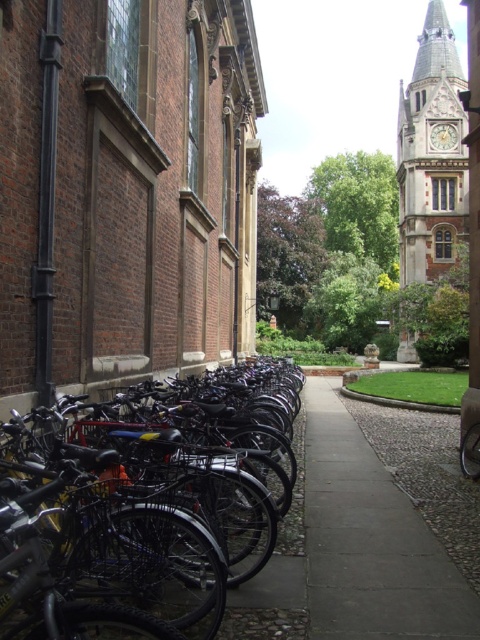
You are standing in front of the brick building and want to take a photo that includes both the point at coordinates point (331, 433) and point (416, 58). Which point will appear larger in your photo?

Point (331, 433) is closer to the camera than point (416, 58), so it will appear larger in the photo.

You are a visitor trying to locate the main entrance of the building. You see the black matte bicycle at left and the brown stone clock tower at upper right. According to the scene, which object is closer to the entrance?

The black matte bicycle at left is closer to the entrance because it is positioned on the left side of the brown stone clock tower at upper right, implying it is nearer to the building.

You are a visitor trying to locate the main entrance of the building. You see the gray concrete pavement at center and the brown stone clock tower at upper right. According to the scene, which object is closer to the left side of the building?

The gray concrete pavement at center is positioned on the left side of the brown stone clock tower at upper right, so it is closer to the left side of the building.